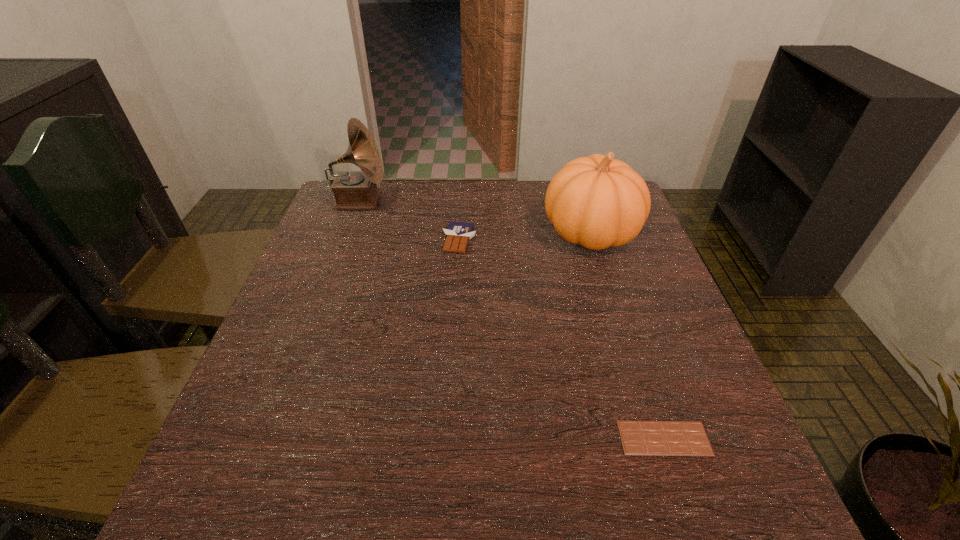
At what (x,y) coordinates should I click in order to perform the action: click on phonograph record situated at the far edge. Please return your answer as a coordinate pair (x, y). Looking at the image, I should click on tap(352, 189).

Find the location of a particular element. The width and height of the screenshot is (960, 540). pumpkin at the far edge is located at coordinates (597, 201).

In order to click on chocolate bar that is at the far edge in this screenshot , I will do `click(458, 234)`.

Identify the location of object that is at the left edge. (352, 189).

Locate an element on the screen. pumpkin located at the right edge is located at coordinates [597, 201].

Find the location of a particular element. chocolate bar at the right edge is located at coordinates (639, 438).

Where is `object that is at the far left corner`? object that is at the far left corner is located at coordinates (352, 189).

At what (x,y) coordinates should I click in order to perform the action: click on object located in the far right corner section of the desktop. Please return your answer as a coordinate pair (x, y). This screenshot has height=540, width=960. Looking at the image, I should click on (597, 201).

Locate an element on the screen. vacant space at the far edge of the desktop is located at coordinates (409, 200).

Locate an element on the screen. The image size is (960, 540). free region at the near edge of the desktop is located at coordinates (349, 468).